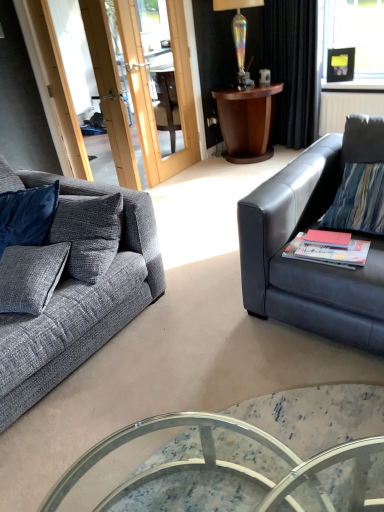
Question: Considering the relative sizes of matte black couch at right, positioned as the 1th studio couch in right-to-left order, and iridescent glass lamp at upper center in the image provided, is matte black couch at right, positioned as the 1th studio couch in right-to-left order, smaller than iridescent glass lamp at upper center?

Choices:
 (A) no
 (B) yes

Answer: (A)

Question: Is matte black couch at right, positioned as the second studio couch in left-to-right order, to the right of iridescent glass lamp at upper center from the viewer's perspective?

Choices:
 (A) yes
 (B) no

Answer: (A)

Question: Considering the relative sizes of matte black couch at right, positioned as the second studio couch in left-to-right order, and iridescent glass lamp at upper center in the image provided, is matte black couch at right, positioned as the second studio couch in left-to-right order, wider than iridescent glass lamp at upper center?

Choices:
 (A) no
 (B) yes

Answer: (B)

Question: From the image's perspective, is matte black couch at right, positioned as the 1th studio couch in right-to-left order, located beneath iridescent glass lamp at upper center?

Choices:
 (A) yes
 (B) no

Answer: (A)

Question: Does matte black couch at right, positioned as the 1th studio couch in right-to-left order, have a larger size compared to iridescent glass lamp at upper center?

Choices:
 (A) yes
 (B) no

Answer: (A)

Question: Is matte black couch at right, positioned as the second studio couch in left-to-right order, closer to camera compared to iridescent glass lamp at upper center?

Choices:
 (A) yes
 (B) no

Answer: (A)

Question: Is marble glass coffee table at center smaller than matte white coffee cup at upper center?

Choices:
 (A) no
 (B) yes

Answer: (A)

Question: Can you confirm if marble glass coffee table at center is positioned to the left of matte white coffee cup at upper center?

Choices:
 (A) yes
 (B) no

Answer: (A)

Question: From the image's perspective, is marble glass coffee table at center located above matte white coffee cup at upper center?

Choices:
 (A) yes
 (B) no

Answer: (B)

Question: Considering the relative sizes of marble glass coffee table at center and matte white coffee cup at upper center in the image provided, is marble glass coffee table at center taller than matte white coffee cup at upper center?

Choices:
 (A) no
 (B) yes

Answer: (B)

Question: From the image's perspective, would you say marble glass coffee table at center is shown under matte white coffee cup at upper center?

Choices:
 (A) yes
 (B) no

Answer: (A)

Question: Would you say matte white coffee cup at upper center is part of marble glass coffee table at center's contents?

Choices:
 (A) yes
 (B) no

Answer: (B)

Question: Is matte red book at right, which ranks as the 1th book in left-to-right order, at the back of iridescent glass lamp at upper center?

Choices:
 (A) no
 (B) yes

Answer: (A)